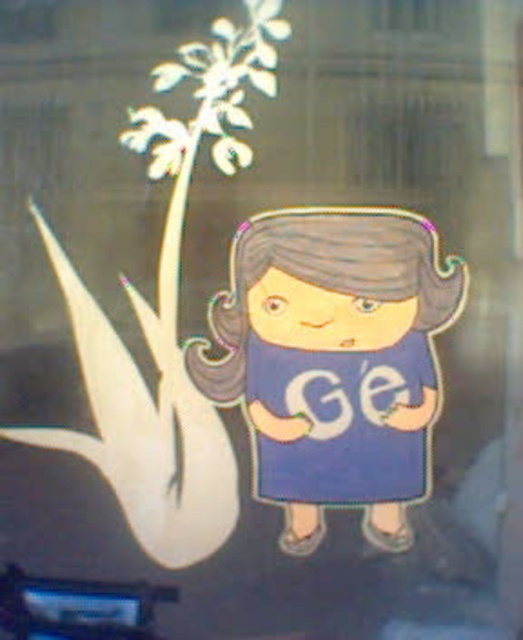
Consider the image. Is matte blue dress at center positioned at the back of blue fabric dress at center?

No, it is in front of blue fabric dress at center.

Which is behind, point (302, 284) or point (358, 353)?

Point (358, 353)

Where is `matte blue dress at center`? matte blue dress at center is located at coordinates 335,362.